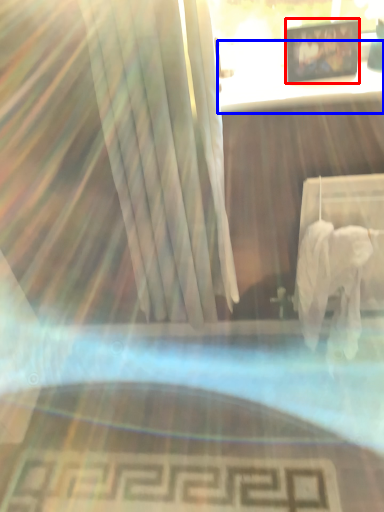
Question: Which of the following is the closest to the observer, picture frame (highlighted by a red box) or table (highlighted by a blue box)?

Choices:
 (A) picture frame
 (B) table

Answer: (B)